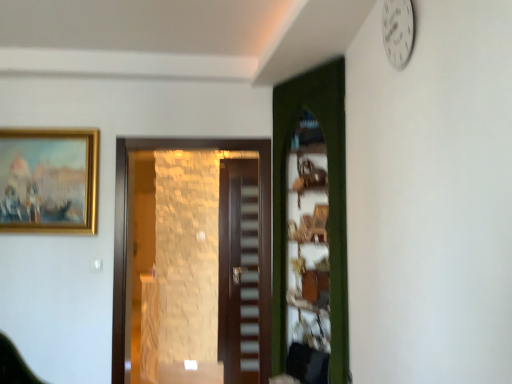
The image size is (512, 384). In order to click on free space above gold-framed painting at upper left (from a real-world perspective) in this screenshot , I will do `click(40, 128)`.